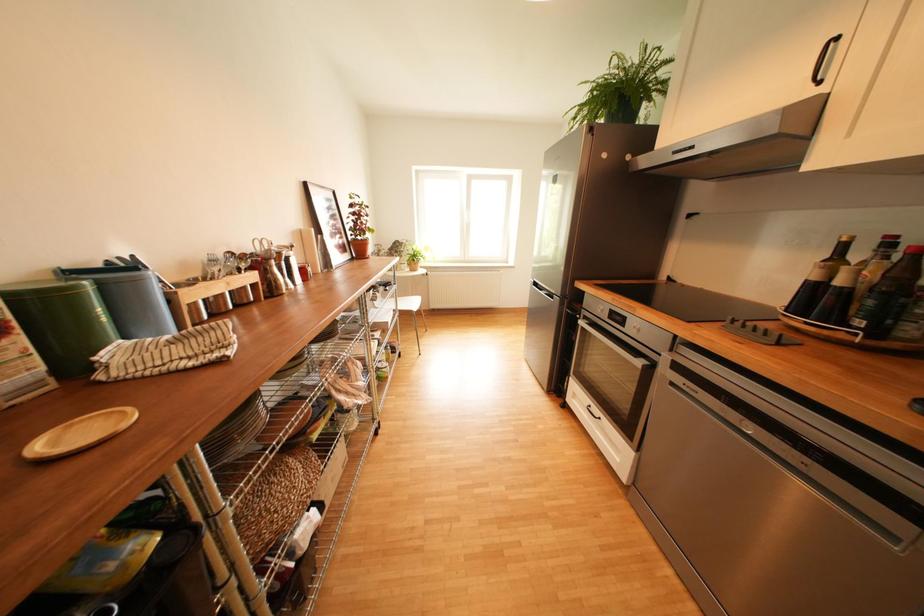
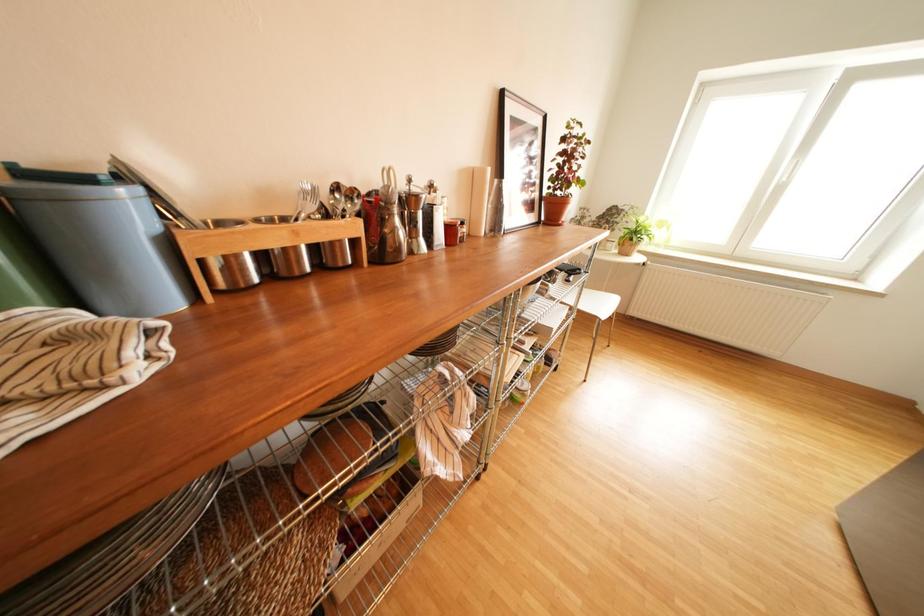
Question: The camera is either moving clockwise (left) or counter-clockwise (right) around the object. The first image is from the beginning of the video and the second image is from the end. Is the camera moving left or right when shooting the video?

Choices:
 (A) Left
 (B) Right

Answer: (B)